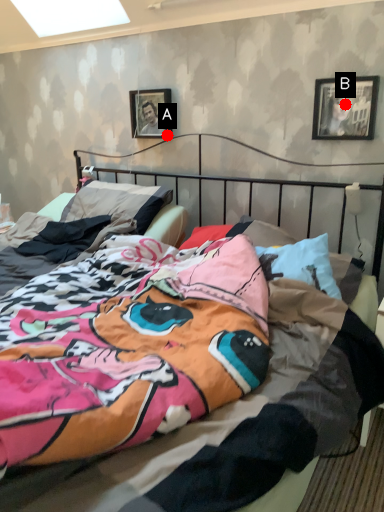
Question: Two points are circled on the image, labeled by A and B beside each circle. Which point appears closest to the camera in this image?

Choices:
 (A) A is closer
 (B) B is closer

Answer: (B)